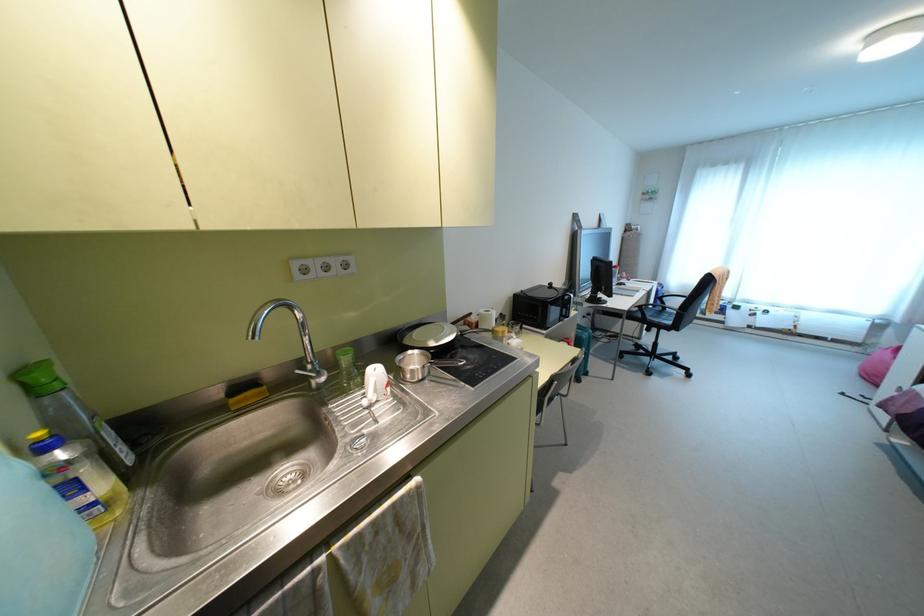
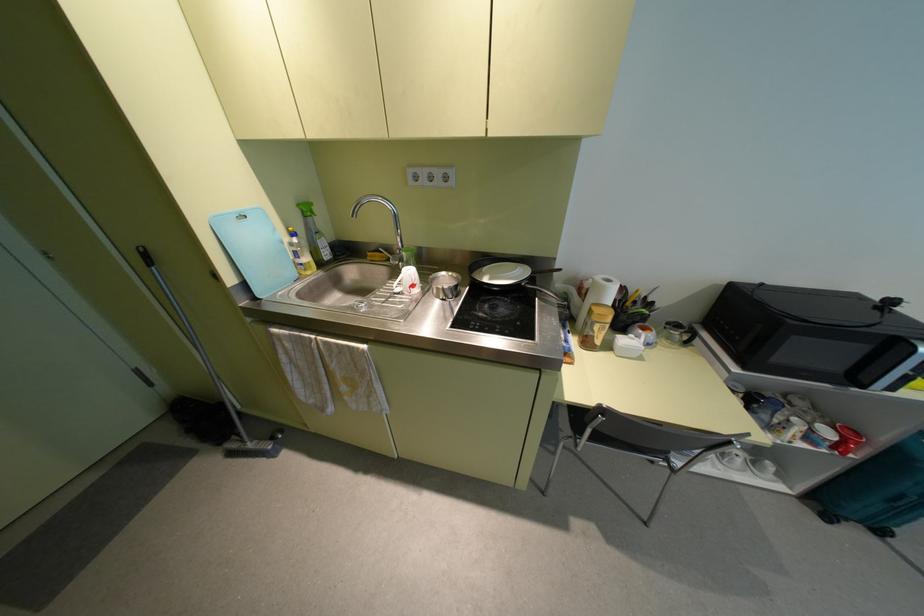
Where in the second image is the point corresponding to (480,310) from the first image?

(599, 277)